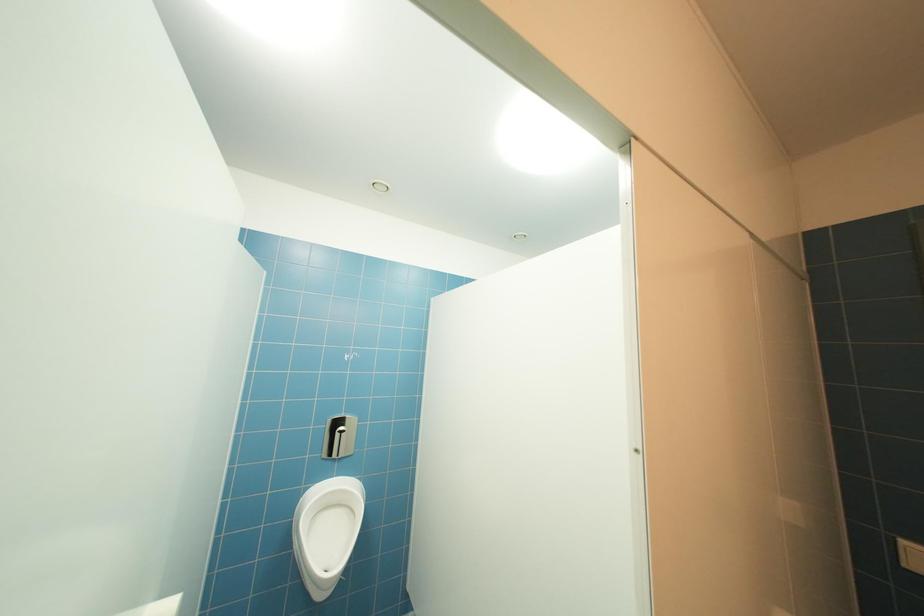
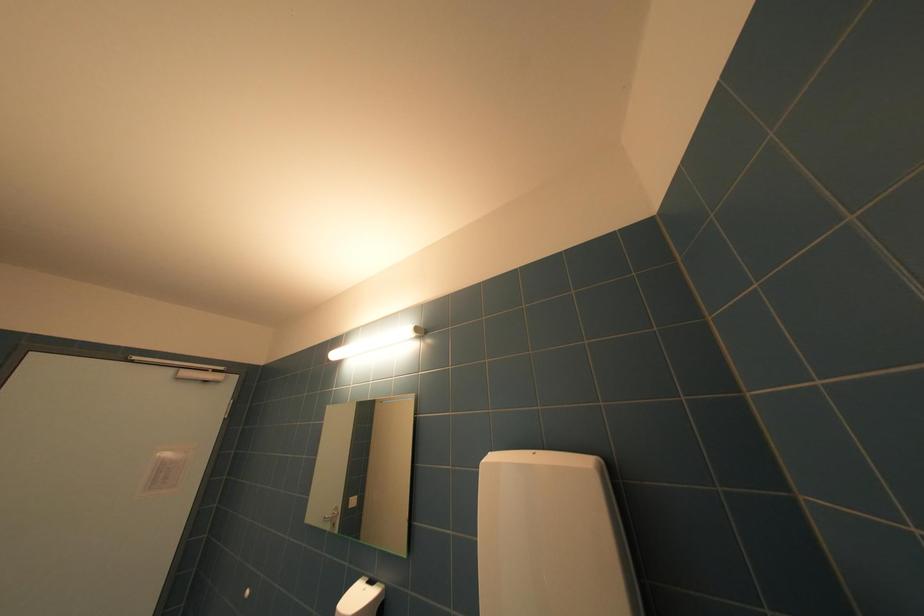
The first image is from the beginning of the video and the second image is from the end. How did the camera likely rotate when shooting the video?

Answer: The rotation direction of the camera is right-up.